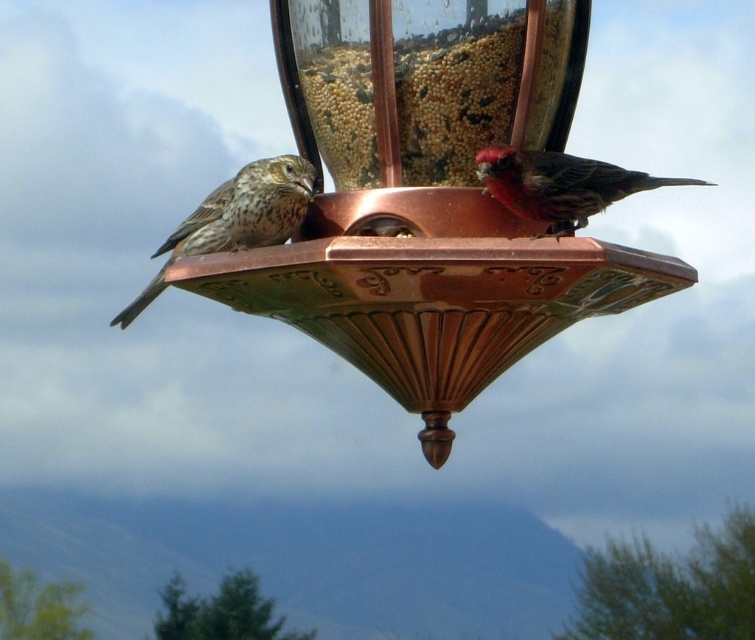
Question: Can you confirm if copper metallic bird feeder at center is wider than reddish-brown feathers at upper right?

Choices:
 (A) no
 (B) yes

Answer: (B)

Question: Which object appears closest to the camera in this image?

Choices:
 (A) reddish-brown feathers at upper right
 (B) copper metallic bird feeder at center

Answer: (B)

Question: Considering the real-world distances, which object is closest to the brown speckled sparrow at left?

Choices:
 (A) reddish-brown feathers at upper right
 (B) copper metallic bird feeder at center

Answer: (B)

Question: Can you confirm if copper metallic bird feeder at center is smaller than reddish-brown feathers at upper right?

Choices:
 (A) yes
 (B) no

Answer: (B)

Question: Does copper metallic bird feeder at center appear on the left side of brown speckled sparrow at left?

Choices:
 (A) no
 (B) yes

Answer: (A)

Question: Which point is farther to the camera?

Choices:
 (A) reddish-brown feathers at upper right
 (B) brown speckled sparrow at left
 (C) copper metallic bird feeder at center

Answer: (B)